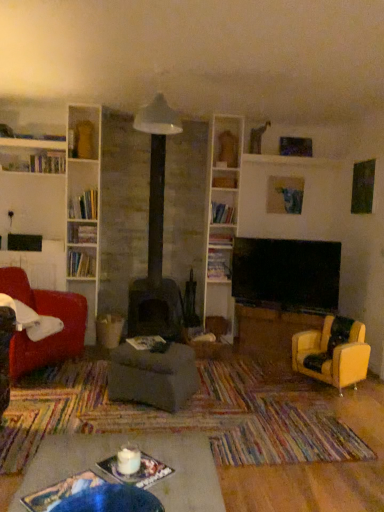
Find the location of a particular element. This screenshot has height=512, width=384. vacant area to the right of dark gray fabric footrest at center is located at coordinates (229, 401).